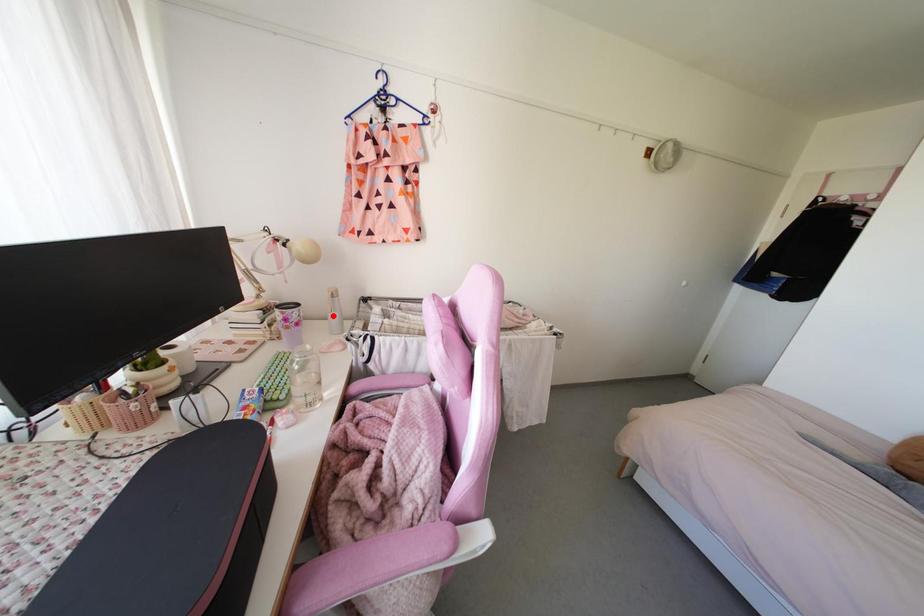
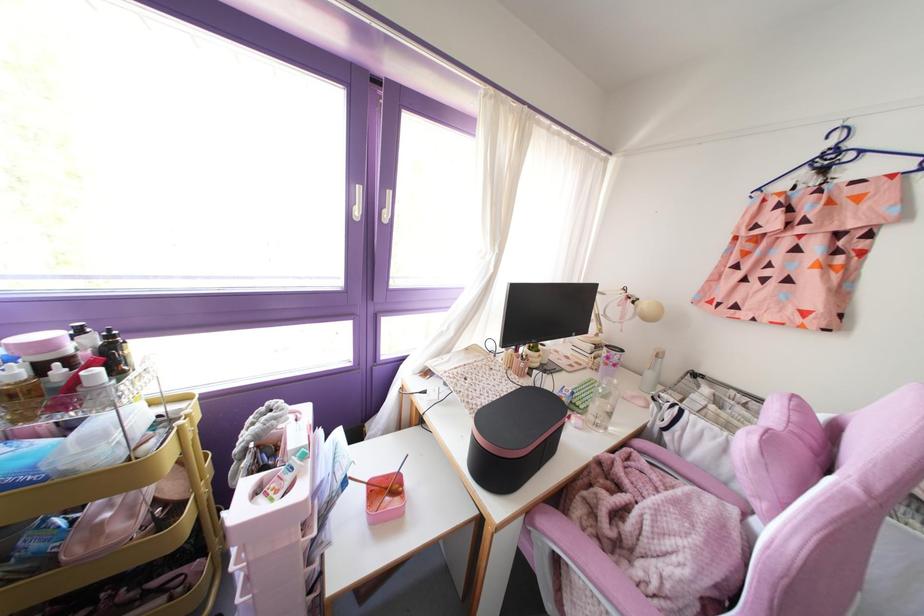
Find the pixel in the second image that matches the highlighted location in the first image.

(649, 374)